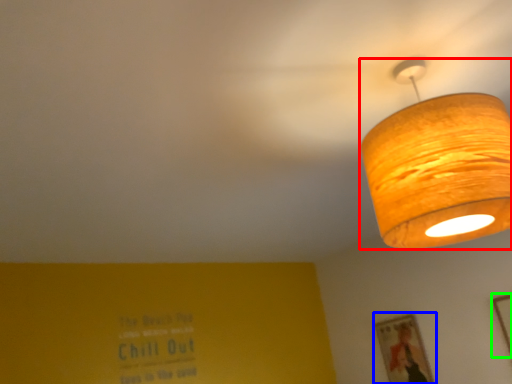
Question: Which object is positioned closest to lamp (highlighted by a red box)? Select from picture frame (highlighted by a blue box) and picture frame (highlighted by a green box).

Choices:
 (A) picture frame
 (B) picture frame

Answer: (B)